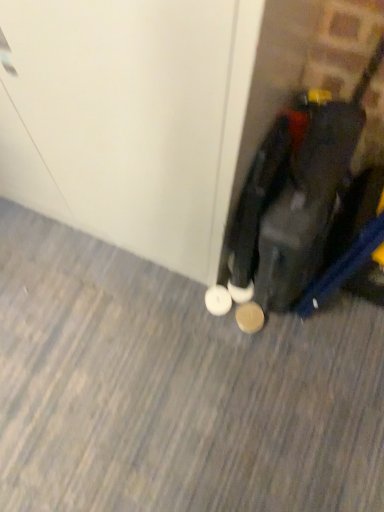
Question: Could you tell me if white glossy door at center is facing brown suede shoe at lower right?

Choices:
 (A) yes
 (B) no

Answer: (B)

Question: Does white glossy door at center appear on the right side of brown suede shoe at lower right?

Choices:
 (A) no
 (B) yes

Answer: (A)

Question: From a real-world perspective, does white glossy door at center sit lower than brown suede shoe at lower right?

Choices:
 (A) yes
 (B) no

Answer: (B)

Question: Is the position of white glossy door at center more distant than that of brown suede shoe at lower right?

Choices:
 (A) no
 (B) yes

Answer: (A)

Question: Can you confirm if white glossy door at center is taller than brown suede shoe at lower right?

Choices:
 (A) yes
 (B) no

Answer: (A)

Question: Does white glossy door at center touch brown suede shoe at lower right?

Choices:
 (A) no
 (B) yes

Answer: (A)

Question: Does brown suede shoe at lower right appear on the right side of white glossy door at center?

Choices:
 (A) no
 (B) yes

Answer: (B)

Question: Is brown suede shoe at lower right smaller than white glossy door at center?

Choices:
 (A) no
 (B) yes

Answer: (B)

Question: Does brown suede shoe at lower right lie behind white glossy door at center?

Choices:
 (A) yes
 (B) no

Answer: (A)

Question: From a real-world perspective, is brown suede shoe at lower right positioned under white glossy door at center based on gravity?

Choices:
 (A) yes
 (B) no

Answer: (A)

Question: Is brown suede shoe at lower right bigger than white glossy door at center?

Choices:
 (A) yes
 (B) no

Answer: (B)

Question: From a real-world perspective, does brown suede shoe at lower right stand above white glossy door at center?

Choices:
 (A) yes
 (B) no

Answer: (B)

Question: Is brown suede shoe at lower right further to camera compared to matte black suitcase at lower right?

Choices:
 (A) no
 (B) yes

Answer: (B)